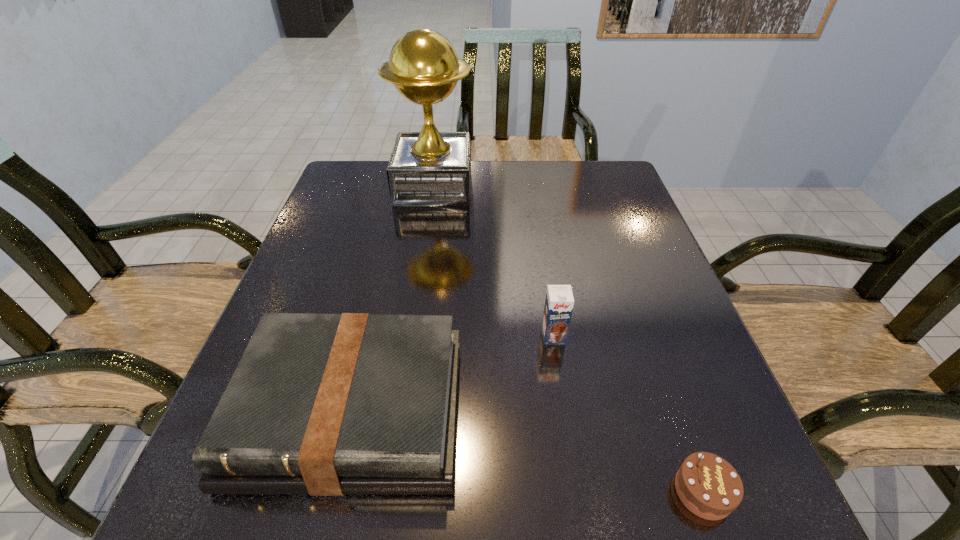
In the image, there is a desktop. At what (x,y) coordinates should I click in order to perform the action: click on vacant region at the right edge. Please return your answer as a coordinate pair (x, y). This screenshot has width=960, height=540. Looking at the image, I should click on (718, 422).

In the image, there is a desktop. Find the location of `vacant space at the far left corner`. vacant space at the far left corner is located at coordinates (353, 175).

Find the location of a particular element. The image size is (960, 540). free location at the far right corner is located at coordinates (617, 167).

The height and width of the screenshot is (540, 960). Find the location of `vacant region between the rightmost object and the third object from left to right`. vacant region between the rightmost object and the third object from left to right is located at coordinates (628, 414).

Image resolution: width=960 pixels, height=540 pixels. In order to click on vacant space that's between the rightmost object and the chocolate milk in this screenshot , I will do `click(628, 414)`.

Image resolution: width=960 pixels, height=540 pixels. Find the location of `free space between the farthest object and the chocolate milk`. free space between the farthest object and the chocolate milk is located at coordinates (493, 261).

You are a GUI agent. You are given a task and a screenshot of the screen. Output one action in this format:
    pyautogui.click(x=<x>, y=<y>)
    Task: Click on the free spot between the chocolate cake and the second object from right to left
    This screenshot has width=960, height=540.
    Given the screenshot: What is the action you would take?
    pyautogui.click(x=628, y=414)

Image resolution: width=960 pixels, height=540 pixels. Identify the location of free space between the third tallest object and the chocolate cake. (527, 451).

Locate an element on the screen. free space between the rightmost object and the hardback book is located at coordinates (527, 451).

Where is `vacant space that is in between the second shortest object and the farthest object`? This screenshot has height=540, width=960. vacant space that is in between the second shortest object and the farthest object is located at coordinates (393, 298).